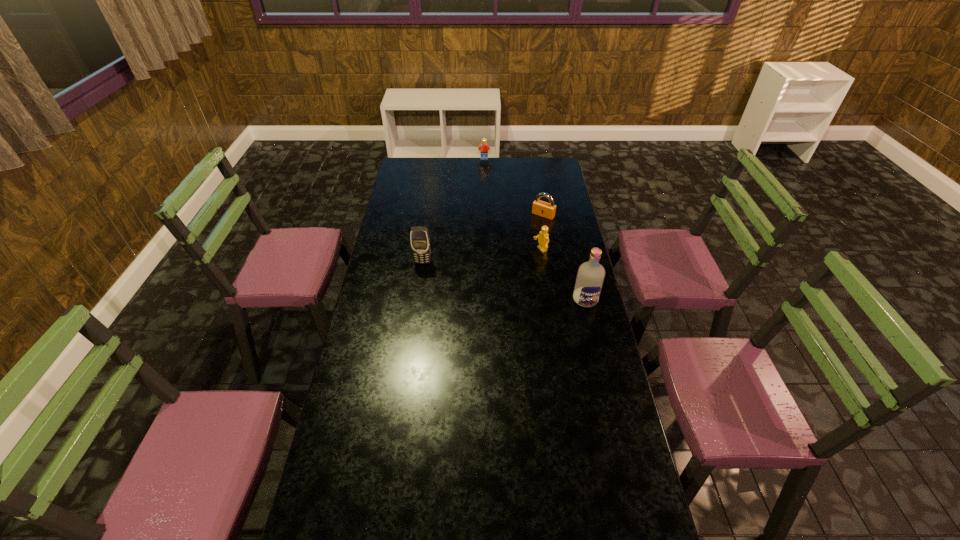
This screenshot has width=960, height=540. Find the location of `free spot located on the label of the tallest object`. free spot located on the label of the tallest object is located at coordinates (604, 380).

Locate an element on the screen. The image size is (960, 540). vacant position located 0.140m on the front-facing side of the fourth object from right to left is located at coordinates (484, 173).

At what (x,y) coordinates should I click in order to perform the action: click on vacant space located 0.140m on the front-facing side of the fourth object from right to left. Please return your answer as a coordinate pair (x, y). This screenshot has width=960, height=540. Looking at the image, I should click on (484, 173).

Where is `free location located 0.100m on the front-facing side of the fourth object from right to left`? The image size is (960, 540). free location located 0.100m on the front-facing side of the fourth object from right to left is located at coordinates (484, 169).

Locate an element on the screen. This screenshot has width=960, height=540. free region located 0.310m to unlock the padlock from the front is located at coordinates (508, 256).

The height and width of the screenshot is (540, 960). In order to click on free space located to unlock the padlock from the front in this screenshot , I will do `click(520, 241)`.

I want to click on vacant space positioned 0.120m to unlock the padlock from the front, so click(527, 233).

Identify the location of free space located 0.400m on the face of the right Lego. [454, 284].

Where is `free location located on the face of the right Lego`? This screenshot has height=540, width=960. free location located on the face of the right Lego is located at coordinates (486, 272).

Where is `free spot located 0.360m on the face of the right Lego`? Image resolution: width=960 pixels, height=540 pixels. free spot located 0.360m on the face of the right Lego is located at coordinates point(463,281).